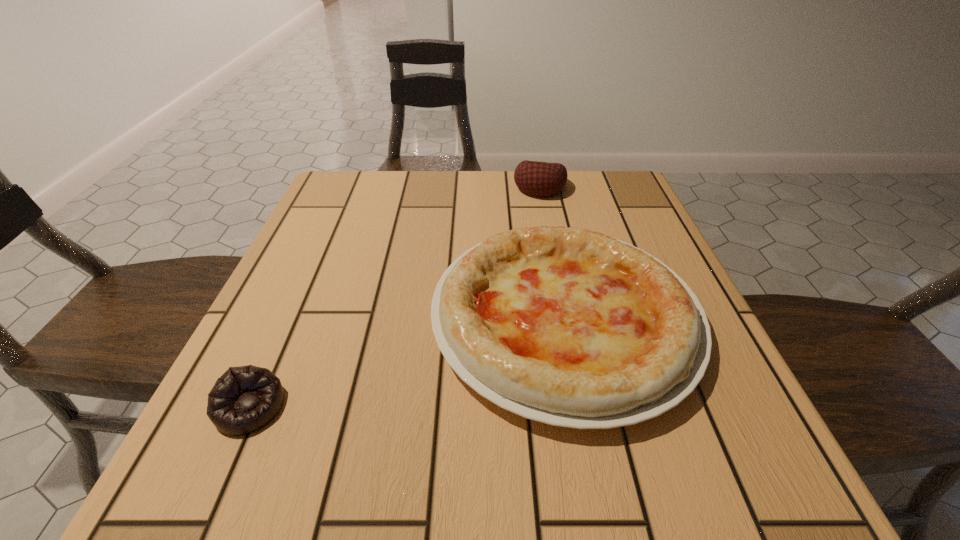
Where is `object that is at the left edge`? This screenshot has height=540, width=960. object that is at the left edge is located at coordinates (244, 399).

Find the location of a particular element. This screenshot has height=540, width=960. object present at the right edge is located at coordinates (569, 327).

I want to click on object situated at the near left corner, so click(244, 399).

Where is `object that is positioned at the near right corner`? object that is positioned at the near right corner is located at coordinates (569, 327).

I want to click on free space at the far edge, so click(575, 217).

In the image, there is a desktop. Identify the location of vacant space at the left edge. The image size is (960, 540). (297, 240).

In order to click on vacant region at the far left corner of the desktop in this screenshot , I will do `click(343, 198)`.

The height and width of the screenshot is (540, 960). In the image, there is a desktop. Identify the location of vacant area at the near left corner. (266, 437).

In the image, there is a desktop. Identify the location of free region at the far right corner. (636, 200).

Identify the location of vacant area between the farthest object and the shorter beanbag. (395, 297).